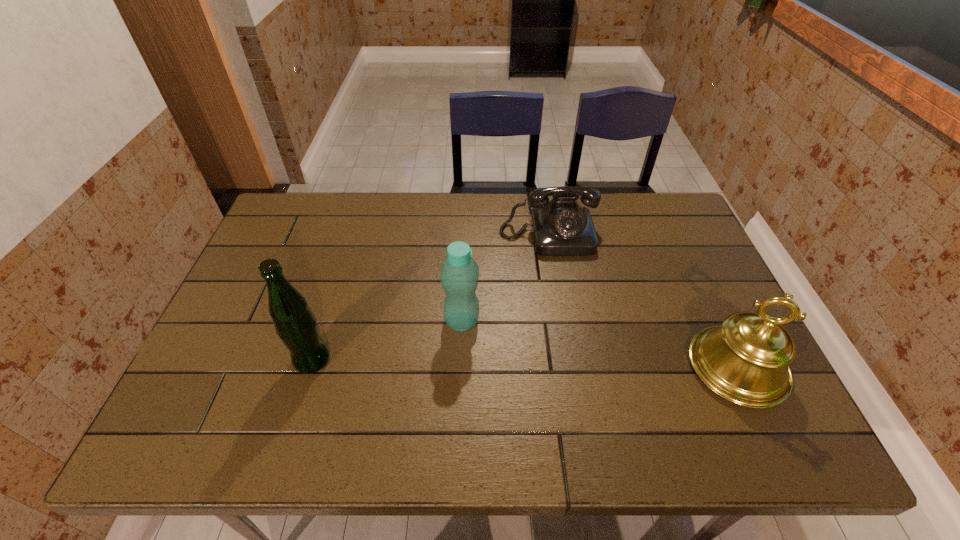
Find the location of a particular element. vacant area that lies between the shortest object and the water bottle is located at coordinates (505, 278).

I want to click on vacant area that lies between the shortest object and the water bottle, so click(x=505, y=278).

At what (x,y) coordinates should I click in order to perform the action: click on vacant space that is in between the tallest object and the second object from left to right. Please return your answer as a coordinate pair (x, y). The height and width of the screenshot is (540, 960). Looking at the image, I should click on (387, 340).

Locate an element on the screen. The image size is (960, 540). free space between the third object from right to left and the leftmost object is located at coordinates (387, 340).

You are a GUI agent. You are given a task and a screenshot of the screen. Output one action in this format:
    pyautogui.click(x=<x>, y=<y>)
    Task: Click on the free point between the bell and the farthest object
    This screenshot has height=540, width=960.
    Given the screenshot: What is the action you would take?
    point(642,301)

Identify which object is the nearest to the beer bottle. Please provide its 2D coordinates. Your answer should be formatted as a tuple, i.e. [(x, y)], where the tuple contains the x and y coordinates of a point satisfying the conditions above.

[(459, 277)]

The height and width of the screenshot is (540, 960). Identify the location of object that is the second nearest to the second object from left to right. (295, 324).

Where is `vacant space that satisfies the following two spatial constraints: 1. on the back side of the beer bottle; 2. on the right side of the water bottle`? The width and height of the screenshot is (960, 540). vacant space that satisfies the following two spatial constraints: 1. on the back side of the beer bottle; 2. on the right side of the water bottle is located at coordinates (324, 321).

Identify the location of free region that satisfies the following two spatial constraints: 1. on the front side of the rightmost object; 2. on the right side of the third object from right to left. The image size is (960, 540). (460, 367).

Where is `vacant area that satisfies the following two spatial constraints: 1. on the front side of the bell; 2. on the right side of the second object from right to left`? This screenshot has height=540, width=960. vacant area that satisfies the following two spatial constraints: 1. on the front side of the bell; 2. on the right side of the second object from right to left is located at coordinates (570, 367).